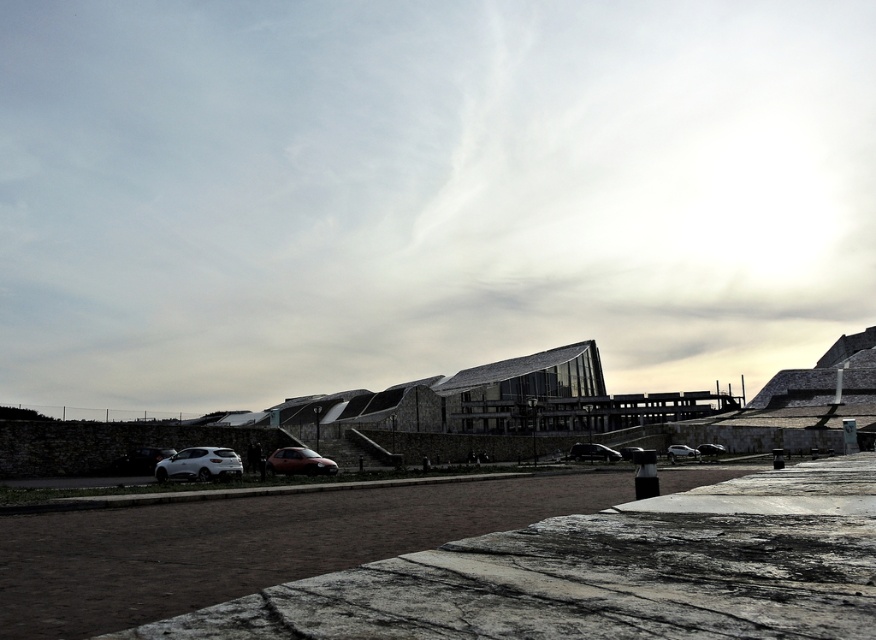
Is matte silver sedan at center smaller than matte black car at center?

No.

This screenshot has width=876, height=640. I want to click on matte silver sedan at center, so click(682, 452).

Identify the location of matte silver sedan at center. The width and height of the screenshot is (876, 640). (682, 452).

Find the location of a particular element. This screenshot has width=876, height=640. matte silver sedan at center is located at coordinates (682, 452).

The image size is (876, 640). What do you see at coordinates (592, 452) in the screenshot?
I see `shiny silver car at center` at bounding box center [592, 452].

Who is more forward, (x=580, y=456) or (x=669, y=452)?

Point (x=580, y=456)

Is point (590, 458) more distant than point (682, 448)?

No.

The width and height of the screenshot is (876, 640). I want to click on shiny silver car at center, so click(x=592, y=452).

Does matte red car at center have a greater height compared to matte black car at center?

In fact, matte red car at center may be shorter than matte black car at center.

Between matte red car at center and matte black car at center, which one is positioned higher?

matte red car at center

Describe the element at coordinates (299, 461) in the screenshot. I see `matte red car at center` at that location.

The width and height of the screenshot is (876, 640). What are the coordinates of `matte red car at center` in the screenshot? It's located at (299, 461).